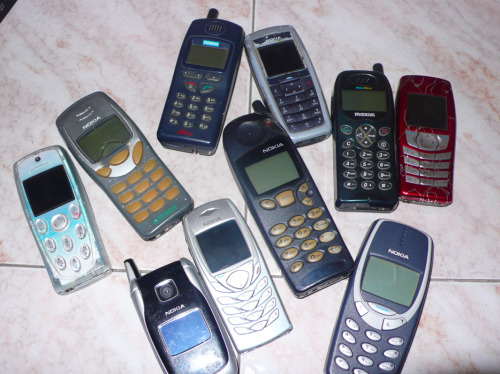
The width and height of the screenshot is (500, 374). Identify the location of screen. (58, 189), (107, 145), (211, 63), (281, 62), (365, 106), (439, 106), (400, 281), (271, 173), (223, 243), (197, 326).